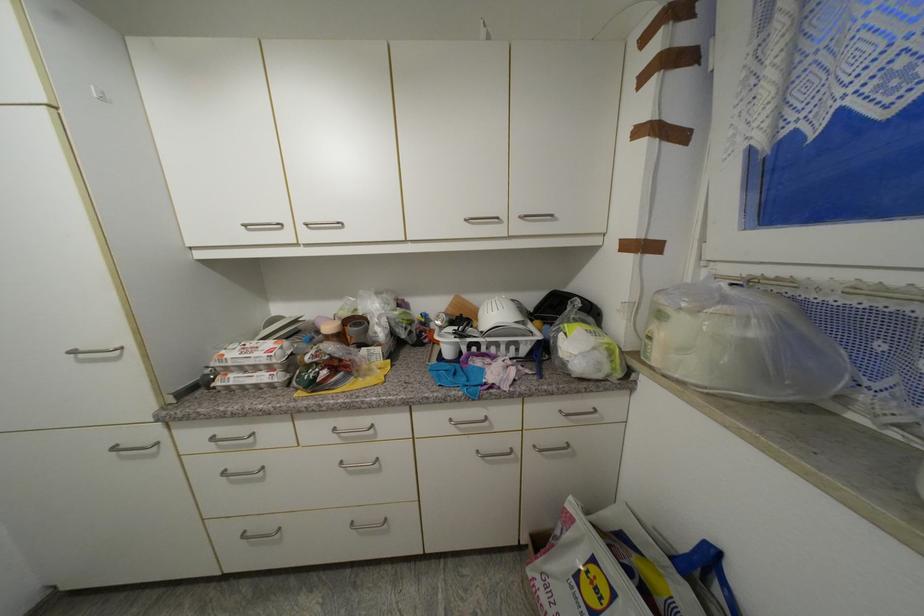
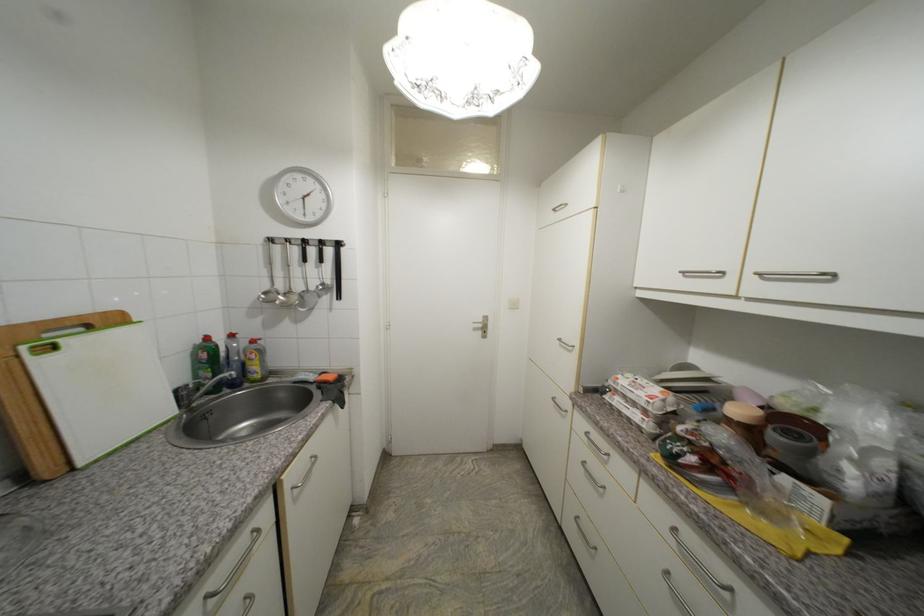
Question: The first image is from the beginning of the video and the second image is from the end. How did the camera likely rotate when shooting the video?

Choices:
 (A) Left
 (B) Right
 (C) Up
 (D) Down

Answer: (A)